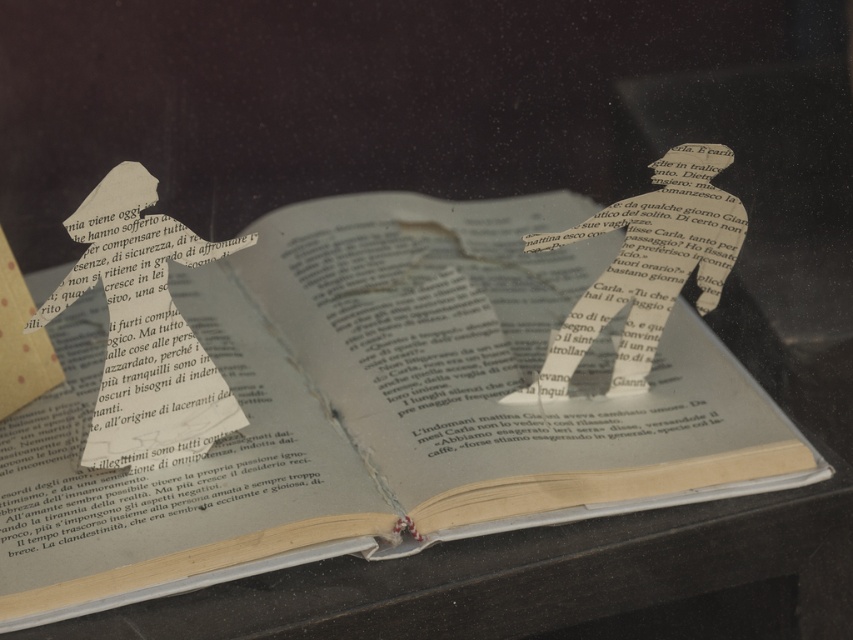
Question: Which is farther from the yellowed paper book at center?

Choices:
 (A) silhouette paper at center
 (B) silvery metallic spoon at center

Answer: (A)

Question: Which is farther from the silvery metallic spoon at center?

Choices:
 (A) silhouette paper at center
 (B) yellowed paper book at center

Answer: (A)

Question: Which of the following is the farthest from the observer?

Choices:
 (A) (213, 422)
 (B) (381, 369)
 (C) (624, 353)

Answer: (B)

Question: Is yellowed paper book at center to the left of silhouette paper at center from the viewer's perspective?

Choices:
 (A) no
 (B) yes

Answer: (A)

Question: Observing the image, what is the correct spatial positioning of yellowed paper book at center in reference to silvery metallic spoon at center?

Choices:
 (A) right
 (B) left

Answer: (B)

Question: Is silhouette paper at center below silvery metallic spoon at center?

Choices:
 (A) no
 (B) yes

Answer: (B)